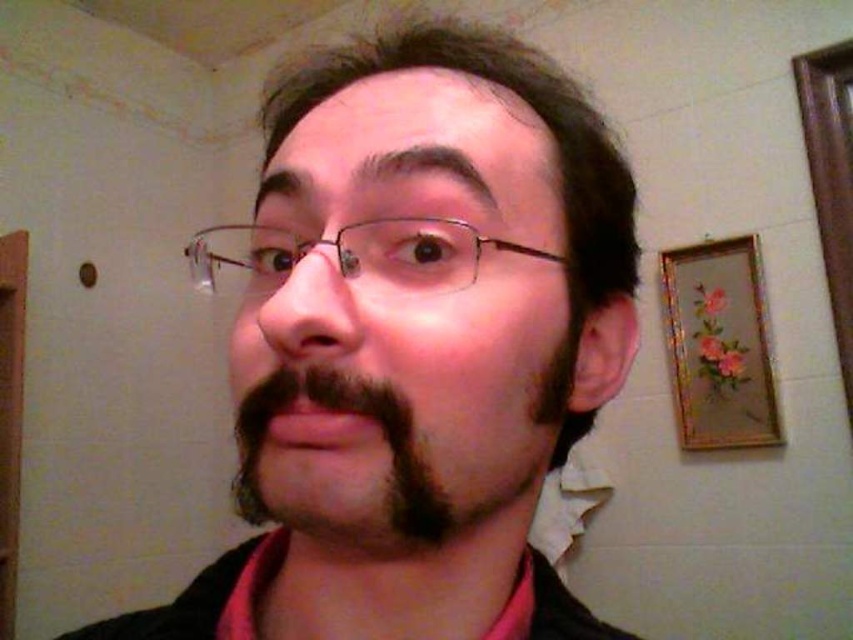
Can you confirm if dark brown fuzzy beard at center is thinner than metallic wireframe glasses at center?

Indeed, dark brown fuzzy beard at center has a lesser width compared to metallic wireframe glasses at center.

Does point (241, 464) lie behind point (196, 257)?

No, it is not.

Find the location of a particular element. dark brown fuzzy beard at center is located at coordinates (381, 438).

The width and height of the screenshot is (853, 640). What do you see at coordinates (413, 346) in the screenshot?
I see `matte black hair at center` at bounding box center [413, 346].

Is matte black hair at center smaller than metallic wireframe glasses at center?

Actually, matte black hair at center might be larger than metallic wireframe glasses at center.

You are a GUI agent. You are given a task and a screenshot of the screen. Output one action in this format:
    pyautogui.click(x=<x>, y=<y>)
    Task: Click on the matte black hair at center
    
    Given the screenshot: What is the action you would take?
    pyautogui.click(x=413, y=346)

Find the location of a particular element. matte black hair at center is located at coordinates (413, 346).

Which of these two, matte black hair at center or dark brown fuzzy beard at center, stands taller?

With more height is matte black hair at center.

Is point (244, 387) behind point (354, 394)?

Yes, point (244, 387) is behind point (354, 394).

Locate an element on the screen. This screenshot has height=640, width=853. matte black hair at center is located at coordinates (413, 346).